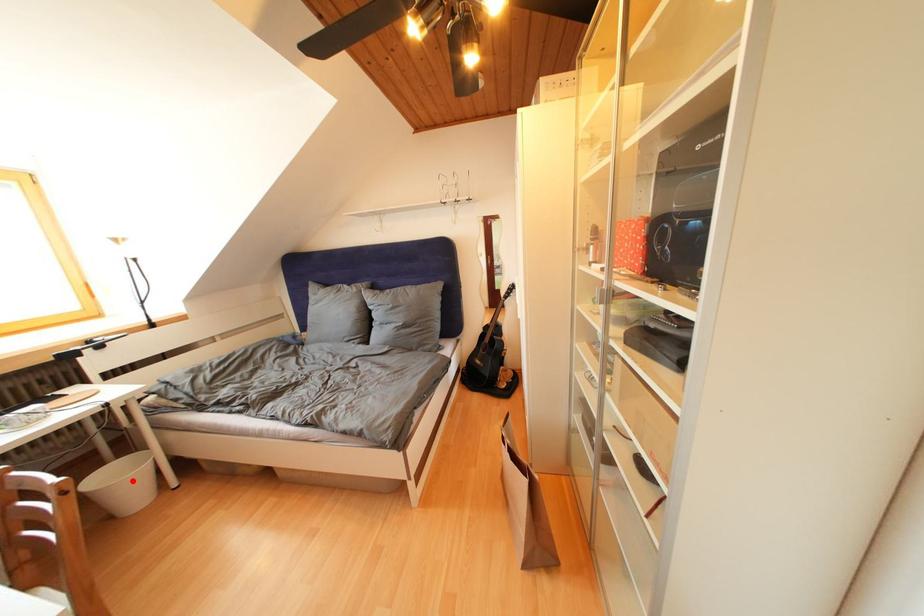
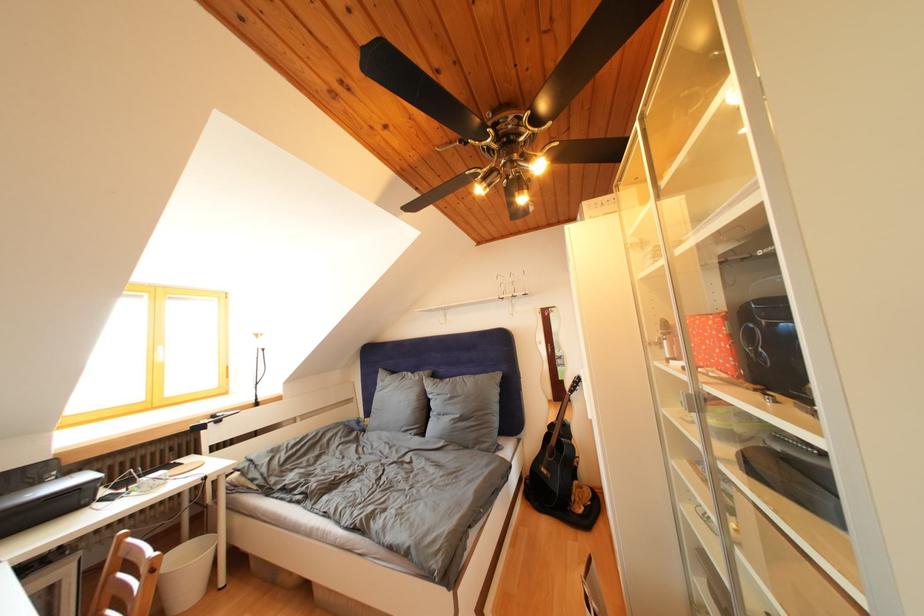
Question: I am providing you with two images of the same scene from different viewpoints. A red point is shown in image1. For the corresponding object point in image2, is it positioned nearer or farther from the camera?

Choices:
 (A) Nearer
 (B) Farther

Answer: (A)